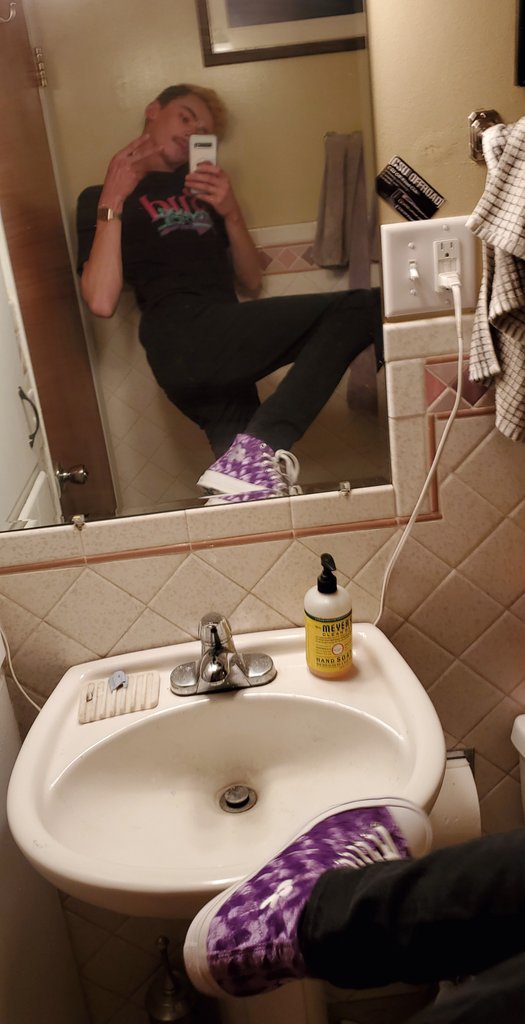
You are a GUI agent. You are given a task and a screenshot of the screen. Output one action in this format:
    pyautogui.click(x=<x>, y=<y>)
    Task: Click on the faucet
    
    Given the screenshot: What is the action you would take?
    pyautogui.click(x=213, y=650)